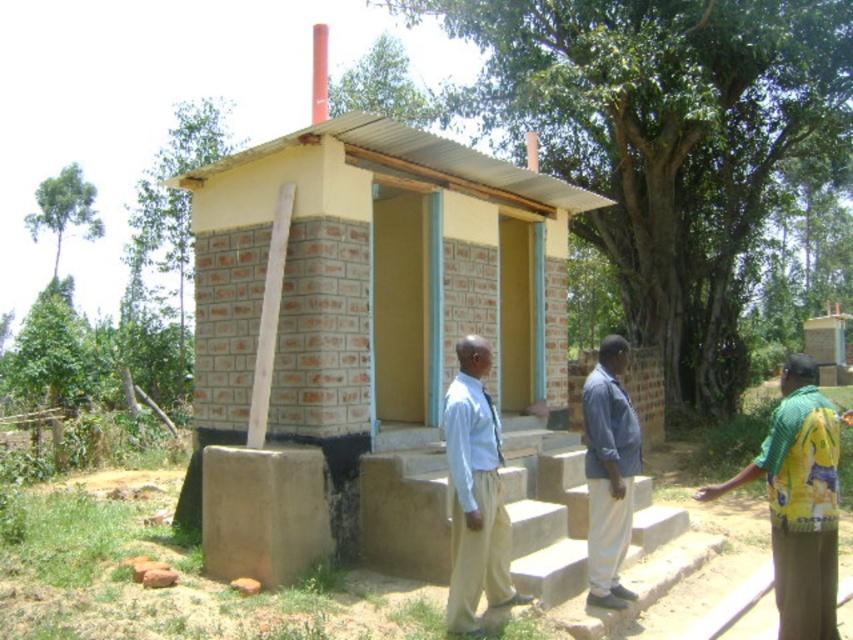
Looking at this image, you are a worker responsible for maintaining the latrine structure. You need to place a 1.8 meter long tool between the green printed shirt at right and the blue fabric shirt at center. Is there enough space to place the tool horizontally between them?

The green printed shirt at right and blue fabric shirt at center are 1.72 meters apart from each other. Since the tool is 1.8 meters long, which is longer than the distance between them, the tool cannot be placed horizontally between them.

You are a maintenance worker tasked with measuring the dimensions of the brown concrete stairs at center and the light blue shirt at center. Which object requires a larger measuring tape to accurately measure its dimensions?

The brown concrete stairs at center requires a larger measuring tape because it has a larger size compared to the light blue shirt at center.